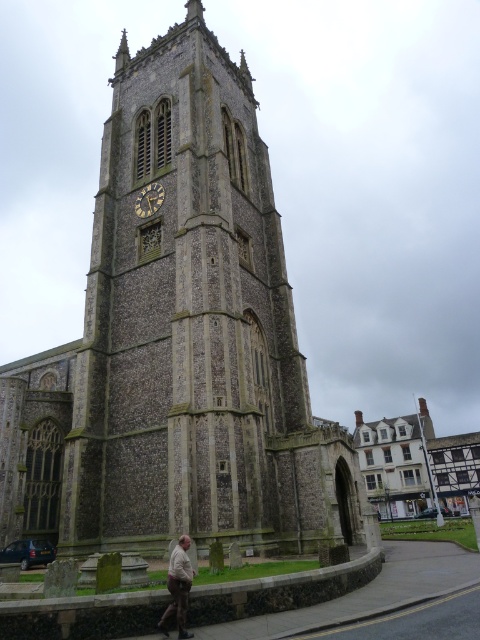
Question: Is brown leather jacket at lower center positioned before gold textured clock at center?

Choices:
 (A) yes
 (B) no

Answer: (A)

Question: Which point is closer to the camera taking this photo?

Choices:
 (A) (137, 205)
 (B) (197, 337)
 (C) (178, 604)

Answer: (C)

Question: In this image, where is brown leather jacket at lower center located relative to gold textured clock at center?

Choices:
 (A) left
 (B) right

Answer: (B)

Question: Is stone clock tower at center wider than gold textured clock at center?

Choices:
 (A) no
 (B) yes

Answer: (B)

Question: Which point is farther to the camera?

Choices:
 (A) (170, 582)
 (B) (141, 205)

Answer: (B)

Question: Among these objects, which one is nearest to the camera?

Choices:
 (A) brown leather jacket at lower center
 (B) gold textured clock at center
 (C) stone clock tower at center

Answer: (A)